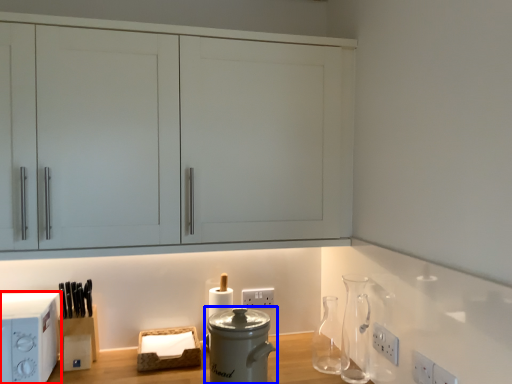
Question: Which object is closer to the camera taking this photo, home appliance (highlighted by a red box) or kitchen appliance (highlighted by a blue box)?

Choices:
 (A) home appliance
 (B) kitchen appliance

Answer: (B)